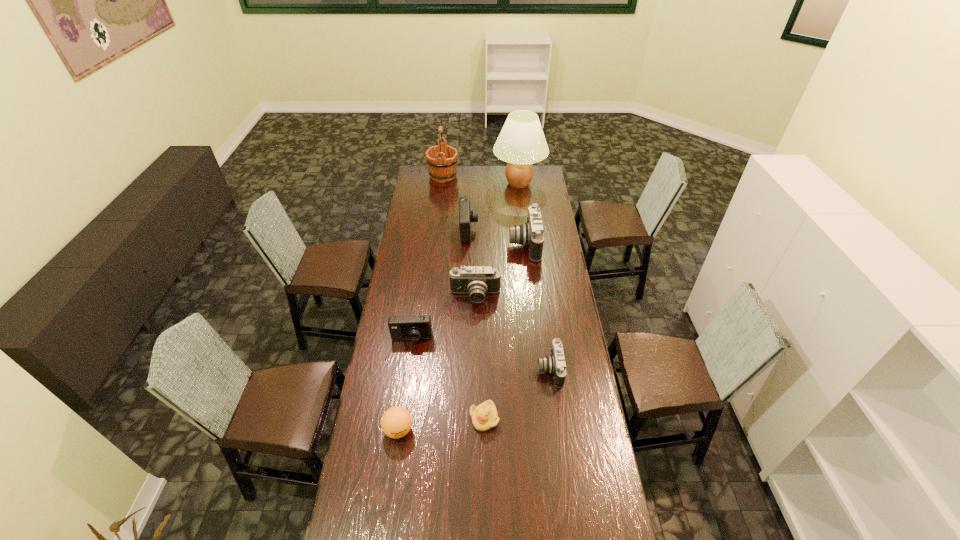
Locate an element on the screen. Image resolution: width=960 pixels, height=540 pixels. object that stands as the sixth closest to the third nearest camera is located at coordinates (396, 422).

The width and height of the screenshot is (960, 540). In order to click on object that is the second closest to the wine bucket in this screenshot , I will do `click(466, 216)`.

Locate an element on the screen. This screenshot has height=540, width=960. camera that is the fourth nearest to the wine bucket is located at coordinates (417, 327).

What are the coordinates of `the second closest camera to the nearest black camera` in the screenshot? It's located at (417, 327).

Select which black camera appears as the closest to the shortest object. Please provide its 2D coordinates. Your answer should be formatted as a tuple, i.e. [(x, y)], where the tuple contains the x and y coordinates of a point satisfying the conditions above.

[(554, 364)]

This screenshot has height=540, width=960. I want to click on the closest black camera to the leftmost black camera, so click(530, 234).

Locate an element on the screen. The height and width of the screenshot is (540, 960). vacant space that satisfies the following two spatial constraints: 1. on the front-facing side of the biggest black camera; 2. on the front-facing side of the duckling is located at coordinates pos(544,418).

What are the coordinates of `free point that satisfies the following two spatial constraints: 1. on the front-facing side of the nearest camera; 2. on the side with brand of the ping-pong ball` in the screenshot? It's located at (558, 430).

You are a GUI agent. You are given a task and a screenshot of the screen. Output one action in this format:
    pyautogui.click(x=<x>, y=<y>)
    Task: Click on the vacant region that satisfies the following two spatial constraints: 1. on the shade of the tallest object; 2. on the front-facing side of the tallest camera
    
    Given the screenshot: What is the action you would take?
    pyautogui.click(x=526, y=244)

Find the location of a particular element. vacant space that satisfies the following two spatial constraints: 1. on the front-facing side of the farthest black camera; 2. on the front-facing side of the third nearest camera is located at coordinates (530, 296).